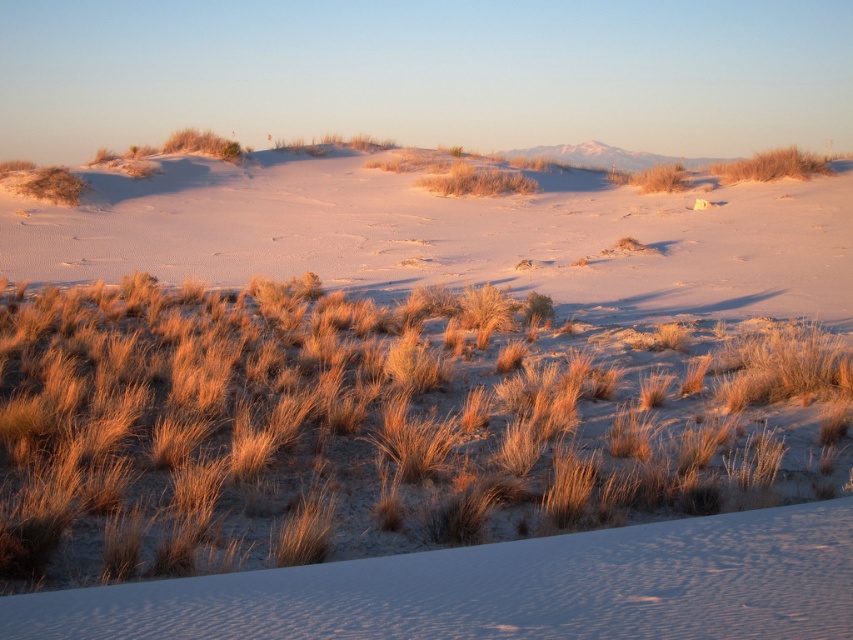
Locate an element on the screen. The width and height of the screenshot is (853, 640). dry grass at center is located at coordinates (376, 424).

Does dry grass at center appear over golden grass at upper center?

No.

Which is in front, point (825, 378) or point (631, 252)?

Point (825, 378) is more forward.

Find the location of a particular element. dry grass at center is located at coordinates (376, 424).